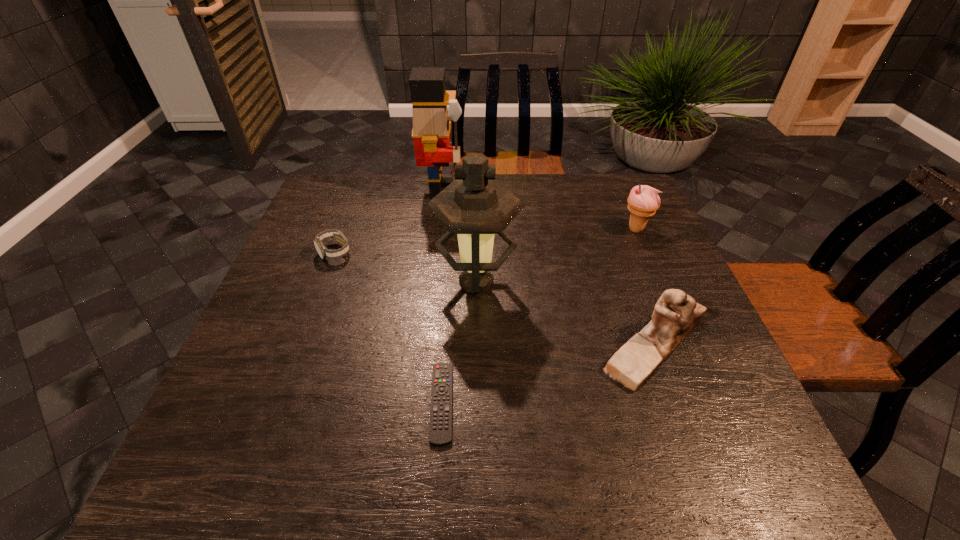
The image size is (960, 540). Identify the location of nutcracker. (431, 129).

At what (x,y) coordinates should I click in order to perform the action: click on oil lamp. Please return your answer as a coordinate pair (x, y). The height and width of the screenshot is (540, 960). Looking at the image, I should click on (475, 206).

This screenshot has width=960, height=540. In order to click on icecream in this screenshot , I will do `click(643, 201)`.

I want to click on figurine, so click(x=676, y=313).

This screenshot has height=540, width=960. I want to click on the fifth tallest object, so click(324, 253).

This screenshot has width=960, height=540. Find the location of `the leftmost object`. the leftmost object is located at coordinates (324, 253).

Identify the location of the shortest object. Image resolution: width=960 pixels, height=540 pixels. (440, 429).

Locate an element on the screen. The image size is (960, 540). blank space located in front of the nutcracker holding the staff is located at coordinates (502, 191).

Identify the location of free space located on the right of the oil lamp. Image resolution: width=960 pixels, height=540 pixels. (547, 282).

Identify the location of blank space located on the front of the icecream. (649, 260).